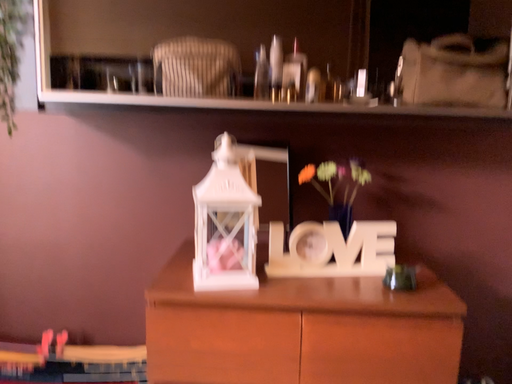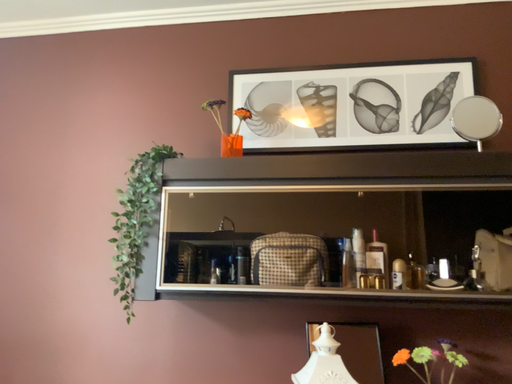
Question: Which way did the camera rotate in the video?

Choices:
 (A) rotated downward
 (B) rotated upward

Answer: (B)